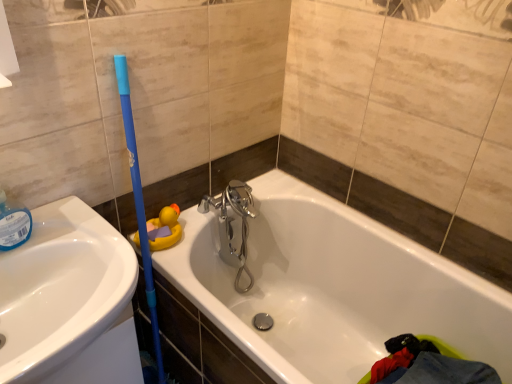
Question: Should I look upward or downward to see white glossy sink at left?

Choices:
 (A) up
 (B) down

Answer: (B)

Question: Could you tell me if yellow rubber duck at upper left is facing white glossy sink at left?

Choices:
 (A) yes
 (B) no

Answer: (B)

Question: Is yellow rubber duck at upper left completely or partially outside of white glossy sink at left?

Choices:
 (A) no
 (B) yes

Answer: (B)

Question: Considering the relative sizes of yellow rubber duck at upper left and white glossy sink at left in the image provided, is yellow rubber duck at upper left thinner than white glossy sink at left?

Choices:
 (A) yes
 (B) no

Answer: (A)

Question: Does yellow rubber duck at upper left appear on the right side of white glossy sink at left?

Choices:
 (A) no
 (B) yes

Answer: (B)

Question: Does yellow rubber duck at upper left lie in front of white glossy sink at left?

Choices:
 (A) yes
 (B) no

Answer: (B)

Question: Is yellow rubber duck at upper left placed right next to white glossy sink at left?

Choices:
 (A) no
 (B) yes

Answer: (A)

Question: Is white glossy bathtub at center completely or partially inside white glossy sink at left?

Choices:
 (A) no
 (B) yes

Answer: (A)

Question: Is white glossy sink at left to the right of white glossy bathtub at center from the viewer's perspective?

Choices:
 (A) yes
 (B) no

Answer: (B)

Question: Is white glossy sink at left smaller than white glossy bathtub at center?

Choices:
 (A) no
 (B) yes

Answer: (B)

Question: Is white glossy sink at left aimed at white glossy bathtub at center?

Choices:
 (A) yes
 (B) no

Answer: (B)

Question: Considering the relative sizes of white glossy sink at left and white glossy bathtub at center in the image provided, is white glossy sink at left bigger than white glossy bathtub at center?

Choices:
 (A) no
 (B) yes

Answer: (A)

Question: Is the depth of white glossy sink at left less than that of white glossy bathtub at center?

Choices:
 (A) no
 (B) yes

Answer: (A)

Question: Is white glossy bathtub at center positioned before white glossy sink at left?

Choices:
 (A) no
 (B) yes

Answer: (B)